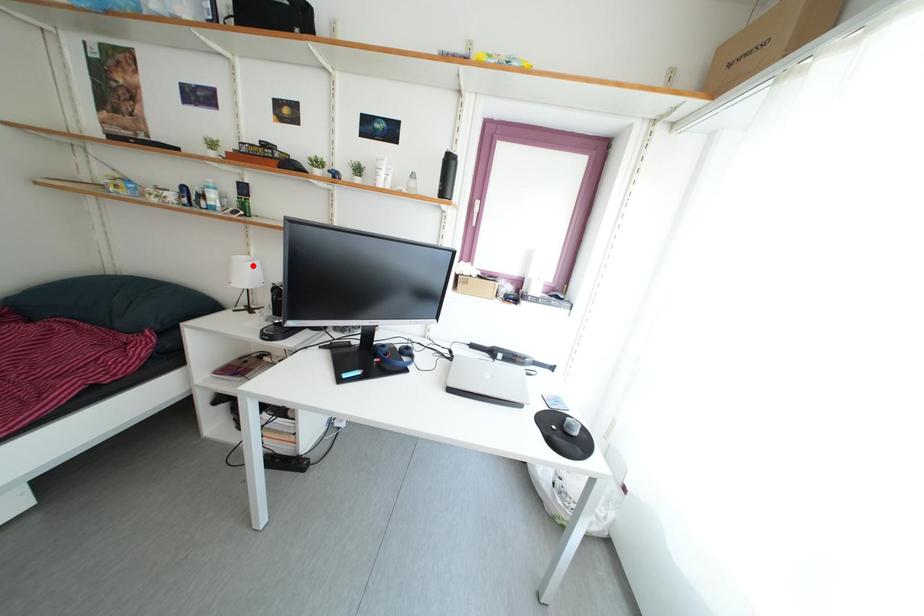
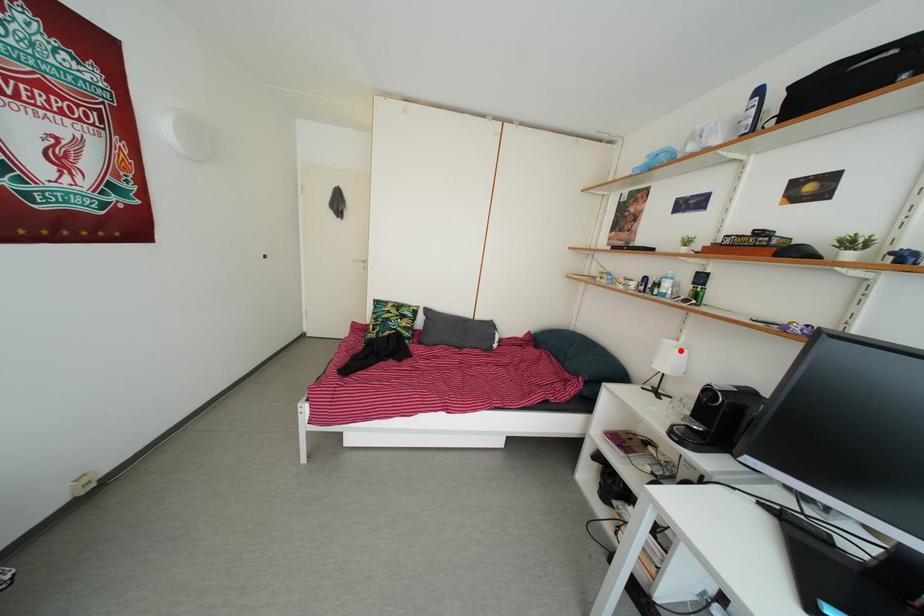
I am providing you with two images of the same scene from different viewpoints. A red point is marked on the first image and another point is marked on the second image. Is the marked point in image1 the same physical position as the marked point in image2?

Yes